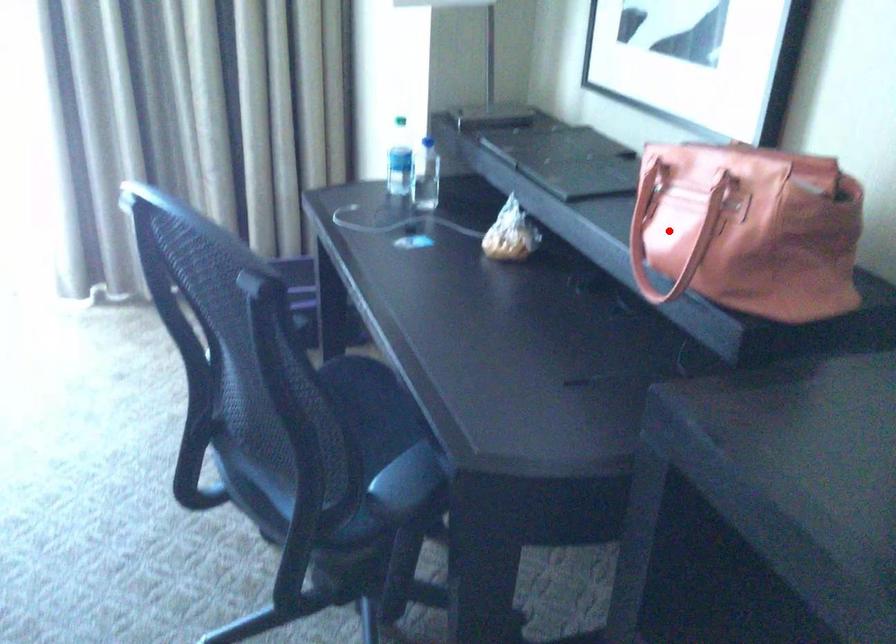
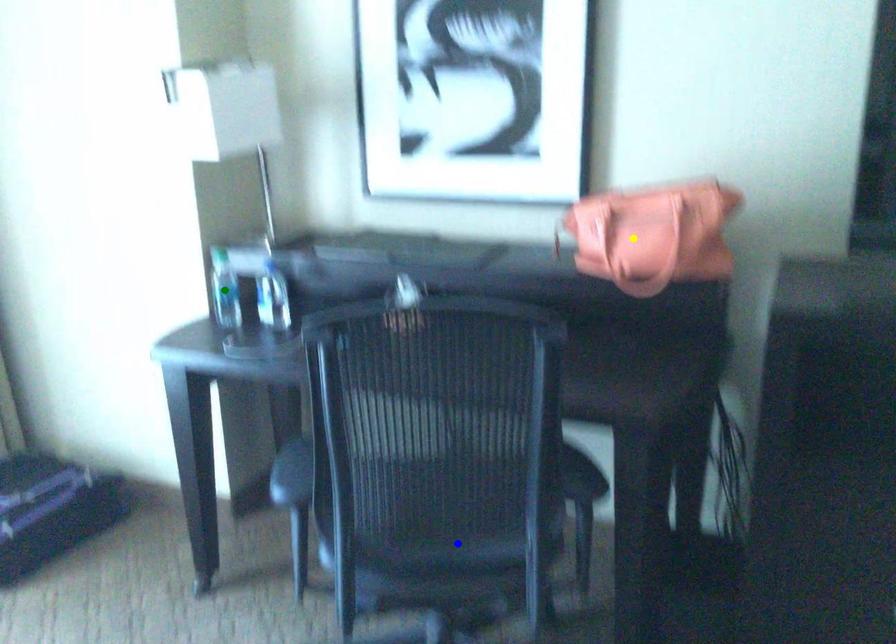
Question: I am providing you with two images of the same scene from different viewpoints. A red point is marked on the first image. You are given multiple points on the second image. Which point in image 2 is actually the same real-world point as the red point in image 1?

Choices:
 (A) yellow point
 (B) green point
 (C) blue point

Answer: (A)